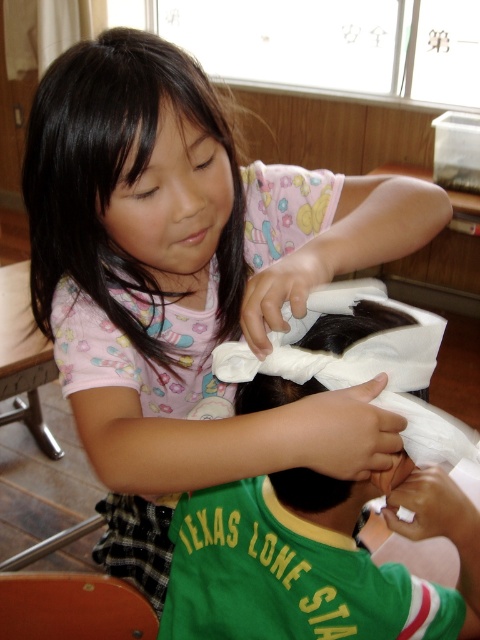
Is white paper towel at center bigger than black silky hair at upper left?

Yes.

Identify the location of white paper towel at center. The width and height of the screenshot is (480, 640). (317, 561).